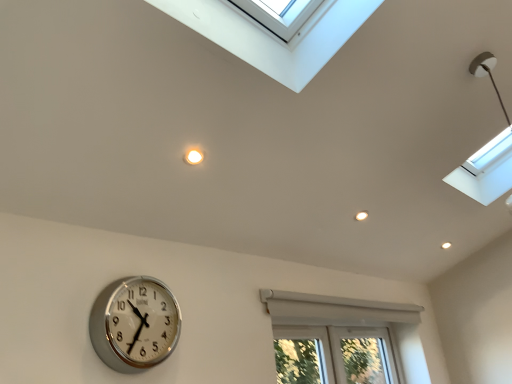
What do you see at coordinates (334, 355) in the screenshot?
I see `white plastic window at lower center` at bounding box center [334, 355].

You are a GUI agent. You are given a task and a screenshot of the screen. Output one action in this format:
    pyautogui.click(x=<x>, y=<y>)
    Task: Click on the white plastic window at lower center
    The height and width of the screenshot is (384, 512).
    Given the screenshot: What is the action you would take?
    pyautogui.click(x=334, y=355)

I want to click on silver metallic clock at lower left, so click(135, 324).

Describe the element at coordinates (135, 324) in the screenshot. I see `silver metallic clock at lower left` at that location.

Where is `white plastic window at lower center`? This screenshot has height=384, width=512. white plastic window at lower center is located at coordinates (334, 355).

Considering the relative positions of white plastic window at lower center and silver metallic clock at lower left in the image provided, is white plastic window at lower center to the left or to the right of silver metallic clock at lower left?

From the image, it's evident that white plastic window at lower center is to the right of silver metallic clock at lower left.

Considering the positions of objects white plastic window at lower center and silver metallic clock at lower left in the image provided, who is in front, white plastic window at lower center or silver metallic clock at lower left?

silver metallic clock at lower left.

Does point (389, 356) lie in front of point (129, 305)?

No, (389, 356) is further to viewer.

From the image's perspective, which one is positioned lower, white plastic window at lower center or silver metallic clock at lower left?

white plastic window at lower center.

From a real-world perspective, is white plastic window at lower center positioned under silver metallic clock at lower left based on gravity?

Yes, from a real-world perspective, white plastic window at lower center is under silver metallic clock at lower left.

In terms of width, does white plastic window at lower center look wider or thinner when compared to silver metallic clock at lower left?

In the image, white plastic window at lower center appears to be more narrow than silver metallic clock at lower left.

In terms of height, does white plastic window at lower center look taller or shorter compared to silver metallic clock at lower left?

Considering their sizes, white plastic window at lower center has more height than silver metallic clock at lower left.

Is white plastic window at lower center bigger or smaller than silver metallic clock at lower left?

Considering their sizes, white plastic window at lower center takes up more space than silver metallic clock at lower left.

Consider the image. Do you think white plastic window at lower center is within silver metallic clock at lower left, or outside of it?

white plastic window at lower center is not enclosed by silver metallic clock at lower left.

Is white plastic window at lower center touching silver metallic clock at lower left?

white plastic window at lower center and silver metallic clock at lower left are not in contact.

Is white plastic window at lower center turned away from silver metallic clock at lower left?

No, white plastic window at lower center is not facing away from silver metallic clock at lower left.

What's the angular difference between white plastic window at lower center and silver metallic clock at lower left's facing directions?

0.455 degrees separate the facing orientations of white plastic window at lower center and silver metallic clock at lower left.

Find the location of a particular element. The image size is (512, 384). bay window located underneath the silver metallic clock at lower left (from a real-world perspective) is located at coordinates (334, 355).

Is silver metallic clock at lower left to the left or to the right of white plastic window at lower center in the image?

From the image, it's evident that silver metallic clock at lower left is to the left of white plastic window at lower center.

Which is in front, silver metallic clock at lower left or white plastic window at lower center?

Positioned in front is silver metallic clock at lower left.

Which is less distant, (169, 317) or (288, 327)?

Point (169, 317) is closer to the camera than point (288, 327).

From the image's perspective, is silver metallic clock at lower left over white plastic window at lower center?

Yes, from the image's perspective, silver metallic clock at lower left is on top of white plastic window at lower center.

From a real-world perspective, is silver metallic clock at lower left on top of white plastic window at lower center?

Correct, in the physical world, silver metallic clock at lower left is higher than white plastic window at lower center.

Consider the image. Is silver metallic clock at lower left wider or thinner than white plastic window at lower center?

Clearly, silver metallic clock at lower left has more width compared to white plastic window at lower center.

From their relative heights in the image, would you say silver metallic clock at lower left is taller or shorter than white plastic window at lower center?

silver metallic clock at lower left is shorter than white plastic window at lower center.

Considering the sizes of objects silver metallic clock at lower left and white plastic window at lower center in the image provided, who is smaller, silver metallic clock at lower left or white plastic window at lower center?

silver metallic clock at lower left.

Is silver metallic clock at lower left not within white plastic window at lower center?

Yes, silver metallic clock at lower left is not within white plastic window at lower center.

Is silver metallic clock at lower left next to white plastic window at lower center and touching it?

There is a gap between silver metallic clock at lower left and white plastic window at lower center.

Looking at this image, is silver metallic clock at lower left oriented away from white plastic window at lower center?

That's not correct — silver metallic clock at lower left is not looking away from white plastic window at lower center.

Can you tell me how much silver metallic clock at lower left and white plastic window at lower center differ in facing direction?

They differ by 0.455 degrees in their facing directions.

Identify the location of bay window on the right of silver metallic clock at lower left. (334, 355).

I want to click on wall clock that is above the white plastic window at lower center (from the image's perspective), so click(x=135, y=324).

The height and width of the screenshot is (384, 512). What are the coordinates of `wall clock above the white plastic window at lower center (from a real-world perspective)` in the screenshot? It's located at (135, 324).